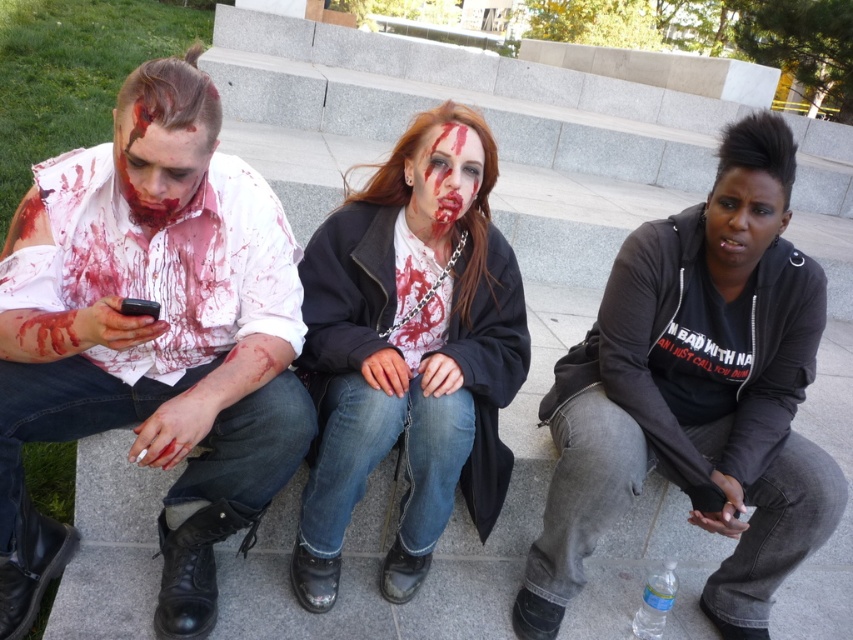
You are a photographer standing at the base of the steps. You want to take a photo of the matte white shirt at left and the black matte face at center so that both are in focus. Given that your camera has a depth of field that can cover 4 feet, will you be able to capture both subjects clearly in the same shot?

The matte white shirt at left is 4.29 feet away from the black matte face at center. Since the distance between them exceeds the camera s 4 feet depth of field, it may be challenging to keep both in focus simultaneously. Consider adjusting your camera settings or moving closer to reduce the distance between the subjects in the frame.

You are standing in front of the scene and want to know which point is closer to you. The points are labeled as point 1 at (744, 356) and point 2 at (161, 157). Which point is closer to you?

Point 1 at (744, 356) is closer to you because it is further to the viewer than point 2 at (161, 157).